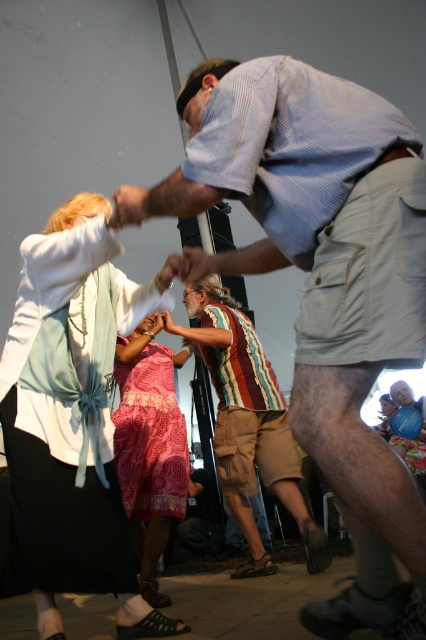
You are a photographer at the event and want to capture the pink textured dress at center and the pink fabric dress at center. Which dress is covering the other one in the image?

The pink textured dress at center is positioned over the pink fabric dress at center, so it is covering the other dress.

Based on the scene description, can you determine the spatial relationship between the light blue fabric at upper left and the smooth skin hand at center?

The light blue fabric at upper left is positioned on the left side of smooth skin hand at center.